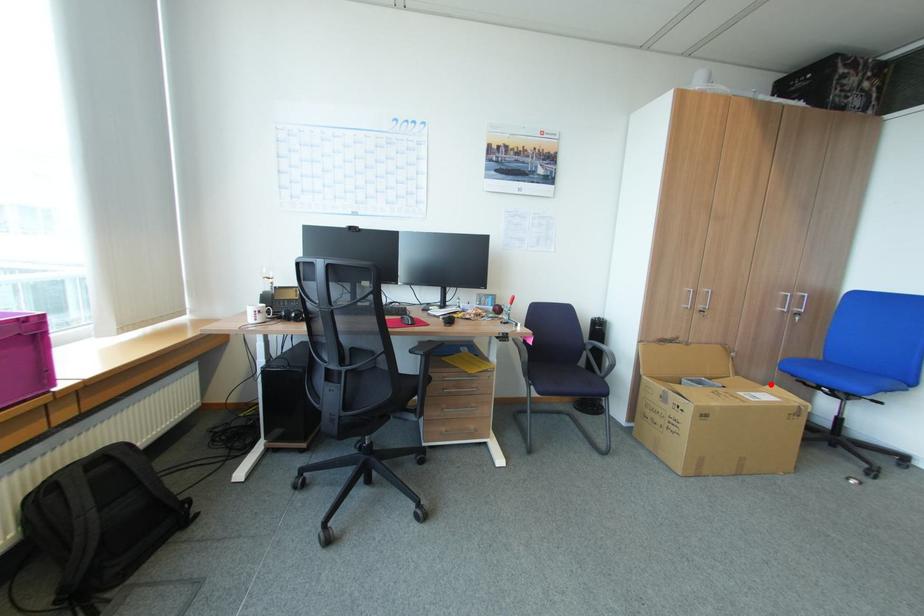
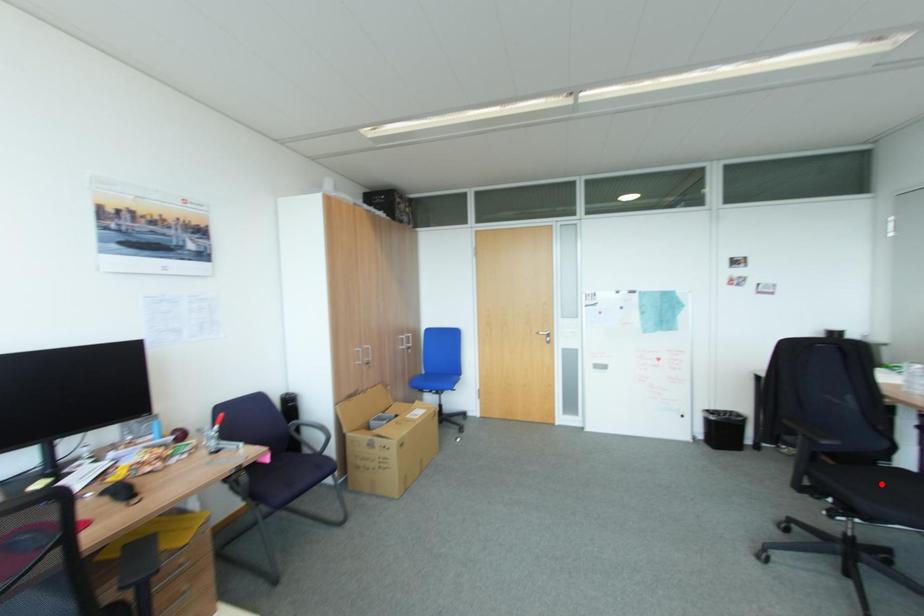
I am providing you with two images of the same scene from different viewpoints. A red point is marked on the first image and another point is marked on the second image. Do the highlighted points in image1 and image2 indicate the same real-world spot?

No